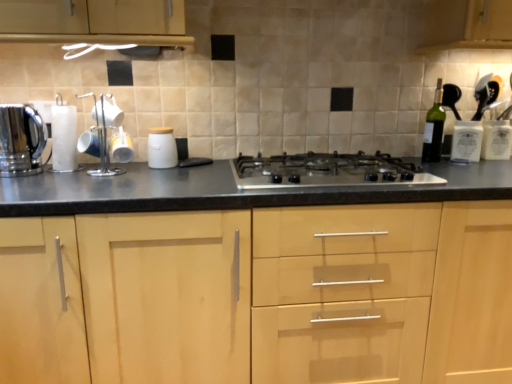
Question: Should I look upward or downward to see polished stainless steel kettle at left, which is the 2th kitchen appliance from right to left?

Choices:
 (A) up
 (B) down

Answer: (A)

Question: Is polished stainless steel kettle at left, which is the 2th kitchen appliance from right to left, to the left of satin silver gas stove at center from the viewer's perspective?

Choices:
 (A) yes
 (B) no

Answer: (A)

Question: Considering the relative sizes of polished stainless steel kettle at left, which is the 2th kitchen appliance from right to left, and satin silver gas stove at center in the image provided, is polished stainless steel kettle at left, which is the 2th kitchen appliance from right to left, shorter than satin silver gas stove at center?

Choices:
 (A) yes
 (B) no

Answer: (B)

Question: Is polished stainless steel kettle at left, which is the 2th kitchen appliance from right to left, beside satin silver gas stove at center?

Choices:
 (A) no
 (B) yes

Answer: (A)

Question: Is the position of polished stainless steel kettle at left, the 1th kitchen appliance from the left, more distant than that of satin silver gas stove at center?

Choices:
 (A) no
 (B) yes

Answer: (B)

Question: Could you tell me if polished stainless steel kettle at left, the 1th kitchen appliance from the left, is facing satin silver gas stove at center?

Choices:
 (A) no
 (B) yes

Answer: (A)

Question: From a real-world perspective, is polished stainless steel kettle at left, which is the 2th kitchen appliance from right to left, located higher than satin silver gas stove at center?

Choices:
 (A) yes
 (B) no

Answer: (A)

Question: Is the position of white matte jar at center, acting as the first kitchen appliance starting from the right, more distant than that of light wood cabinet at center?

Choices:
 (A) yes
 (B) no

Answer: (A)

Question: Does white matte jar at center, acting as the first kitchen appliance starting from the right, have a lesser height compared to light wood cabinet at center?

Choices:
 (A) yes
 (B) no

Answer: (A)

Question: Is white matte jar at center, acting as the first kitchen appliance starting from the right, not near light wood cabinet at center?

Choices:
 (A) no
 (B) yes

Answer: (A)

Question: Is light wood cabinet at center completely or partially inside white matte jar at center, acting as the first kitchen appliance starting from the right?

Choices:
 (A) yes
 (B) no

Answer: (B)

Question: Is white matte jar at center, the second kitchen appliance when ordered from left to right, oriented away from light wood cabinet at center?

Choices:
 (A) yes
 (B) no

Answer: (B)

Question: Does white matte jar at center, acting as the first kitchen appliance starting from the right, come in front of light wood cabinet at center?

Choices:
 (A) yes
 (B) no

Answer: (B)

Question: Is light wood cabinet at center positioned behind white matte jar at center, the second kitchen appliance when ordered from left to right?

Choices:
 (A) yes
 (B) no

Answer: (B)